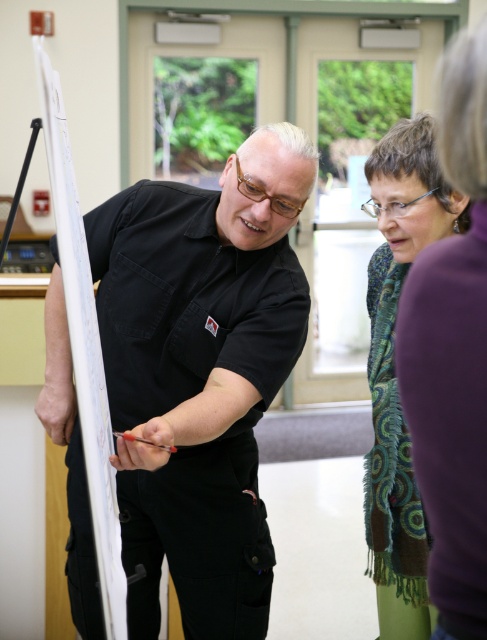
You are standing in the classroom and need to reach the white paperboard at left to write something. However, there is a green textured scarf at center in your way. Can you move around the scarf to access the paperboard?

The white paperboard at left is behind the green textured scarf at center, so you can move around the scarf to access the paperboard.

You are organizing a clothing donation drive and need to categorize items based on size. You have a black cotton shirt at center and a green textured scarf at center. Which item should be placed in the large size bin?

The black cotton shirt at center is bigger than the green textured scarf at center, so the black cotton shirt at center should be placed in the large size bin.